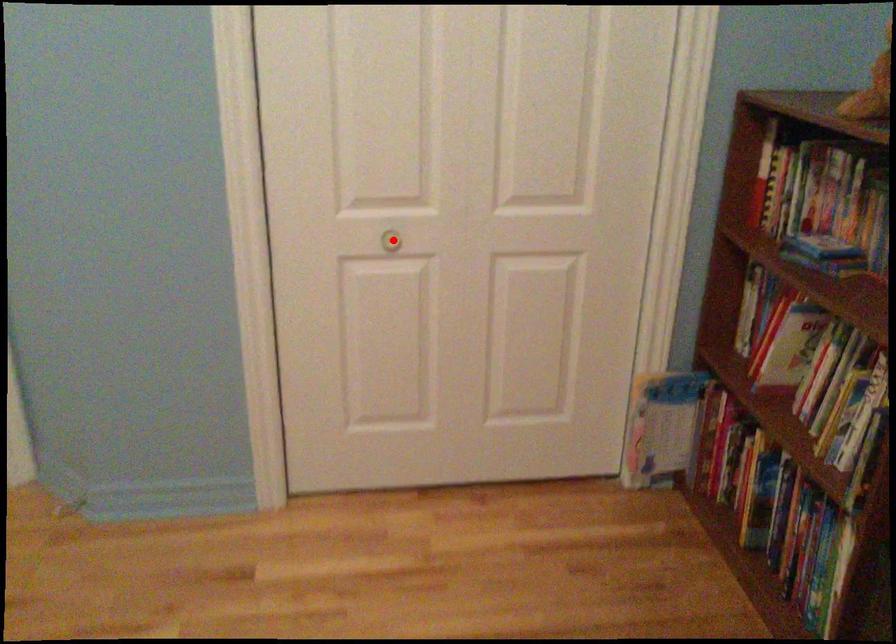
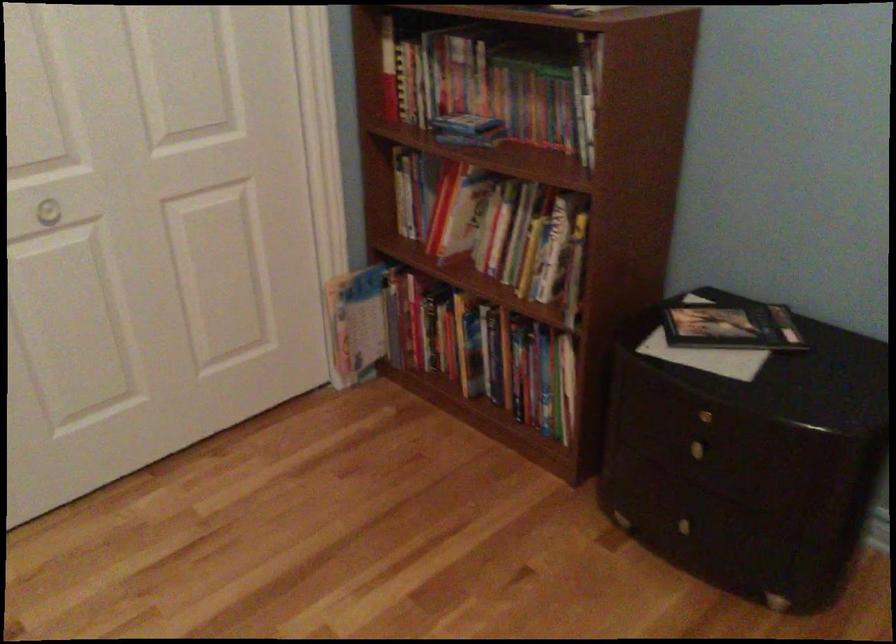
Question: I am providing you with two images of the same scene from different viewpoints. Given a red point in image1, look at the same physical point in image2. Is it:

Choices:
 (A) Closer to the viewpoint
 (B) Farther from the viewpoint

Answer: (A)